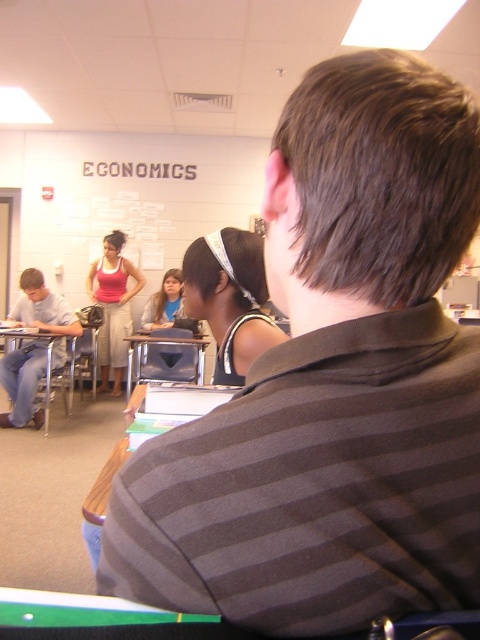
You are a student in the classroom and you want to borrow a white headband at center from your friend. Where should you look to find it?

The white headband at center is located at point (229, 300).

You are a photographer in the classroom and want to take a picture of the white headband at center and the matte pink tank top at center. Which object should you focus on first if you want to capture both clearly in the same frame?

The white headband at center is positioned under the matte pink tank top at center, so you should focus on the matte pink tank top at center first to ensure both are in focus.

You are a classroom assistant who needs to rearrange the desks. The green felt table at lower left and the matte pink tank top at center are in the way. Which object takes up more space and needs to be moved first?

The matte pink tank top at center occupies more space than the green felt table at lower left, so it should be moved first.